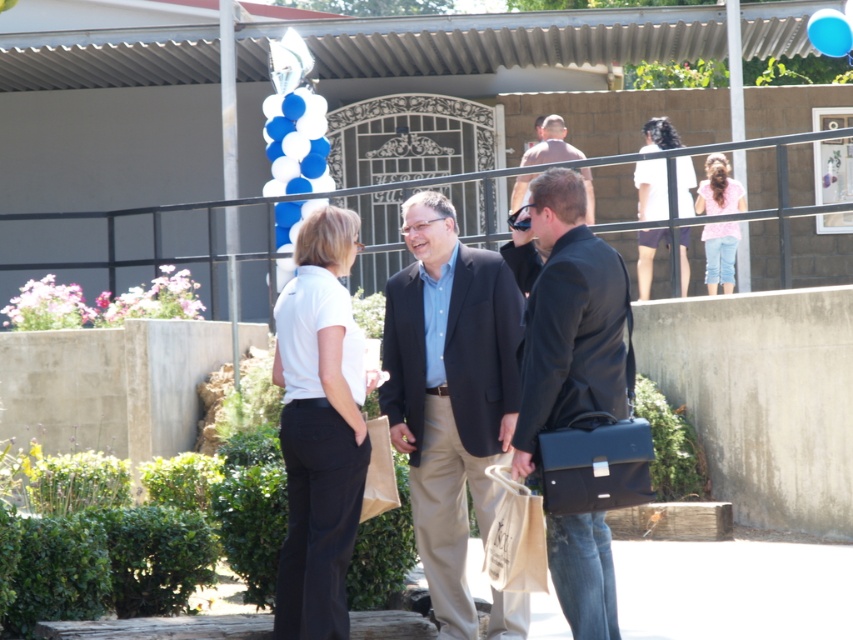
Question: Which of these objects is positioned farthest from the white smooth shirt at center?

Choices:
 (A) white cotton shirt at upper right
 (B) shiny brown shirt at center

Answer: (B)

Question: Among these points, which one is farthest from the camera?

Choices:
 (A) (592, 189)
 (B) (308, 458)
 (C) (508, 296)

Answer: (A)

Question: From the image, what is the correct spatial relationship of white cotton shirt at upper right in relation to pink cotton shirt at upper right?

Choices:
 (A) above
 (B) below

Answer: (A)

Question: Where is matte black suit at center located in relation to matte black briefcase at center in the image?

Choices:
 (A) right
 (B) left

Answer: (B)

Question: Observing the image, what is the correct spatial positioning of white smooth shirt at center in reference to shiny brown shirt at center?

Choices:
 (A) right
 (B) left

Answer: (B)

Question: Which of the following is the closest to the observer?

Choices:
 (A) (589, 180)
 (B) (648, 204)

Answer: (B)